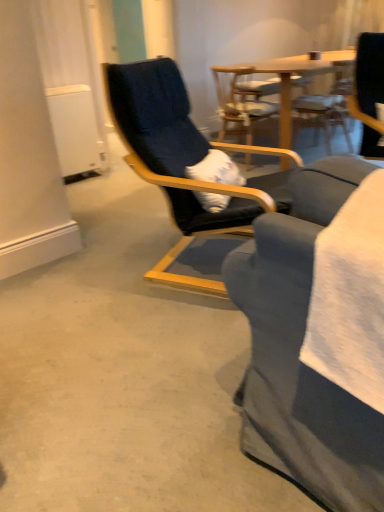
Question: Considering the relative sizes of wooden chair at center, positioned as the 2th chair in back-to-front order, and wooden chair at center, arranged as the third chair when viewed from the front, in the image provided, is wooden chair at center, positioned as the 2th chair in back-to-front order, shorter than wooden chair at center, arranged as the third chair when viewed from the front,?

Choices:
 (A) yes
 (B) no

Answer: (A)

Question: Is wooden chair at center, placed as the second chair when sorted from front to back, in contact with wooden chair at center, arranged as the third chair when viewed from the front?

Choices:
 (A) no
 (B) yes

Answer: (A)

Question: Considering the relative sizes of wooden chair at center, positioned as the 2th chair in back-to-front order, and wooden chair at center, the 1th chair in the back-to-front sequence, in the image provided, is wooden chair at center, positioned as the 2th chair in back-to-front order, bigger than wooden chair at center, the 1th chair in the back-to-front sequence,?

Choices:
 (A) yes
 (B) no

Answer: (B)

Question: Can you confirm if wooden chair at center, placed as the second chair when sorted from front to back, is positioned to the right of wooden chair at center, the 1th chair in the back-to-front sequence?

Choices:
 (A) no
 (B) yes

Answer: (A)

Question: Would you say wooden chair at center, placed as the second chair when sorted from front to back, contains wooden chair at center, the 1th chair in the back-to-front sequence?

Choices:
 (A) no
 (B) yes

Answer: (A)

Question: From a real-world perspective, is black fabric chair at center, acting as the 3th chair starting from the back, physically located above or below wooden chair at center, the 1th chair in the back-to-front sequence?

Choices:
 (A) above
 (B) below

Answer: (A)

Question: In terms of width, does black fabric chair at center, acting as the 3th chair starting from the back, look wider or thinner when compared to wooden chair at center, the 1th chair in the back-to-front sequence?

Choices:
 (A) thin
 (B) wide

Answer: (B)

Question: From the image's perspective, is black fabric chair at center, positioned as the first chair in front-to-back order, located above or below wooden chair at center, the 1th chair in the back-to-front sequence?

Choices:
 (A) above
 (B) below

Answer: (B)

Question: In terms of height, does black fabric chair at center, acting as the 3th chair starting from the back, look taller or shorter compared to wooden chair at center, arranged as the third chair when viewed from the front?

Choices:
 (A) tall
 (B) short

Answer: (A)

Question: Does point (223, 77) appear closer or farther from the camera than point (122, 78)?

Choices:
 (A) closer
 (B) farther

Answer: (B)

Question: Relative to black fabric chair at center, positioned as the first chair in front-to-back order, is wooden chair at center, placed as the second chair when sorted from front to back, in front or behind?

Choices:
 (A) front
 (B) behind

Answer: (B)

Question: From a real-world perspective, is wooden chair at center, positioned as the 2th chair in back-to-front order, positioned above or below black fabric chair at center, acting as the 3th chair starting from the back?

Choices:
 (A) above
 (B) below

Answer: (B)

Question: From the image's perspective, is wooden chair at center, placed as the second chair when sorted from front to back, located above or below black fabric chair at center, acting as the 3th chair starting from the back?

Choices:
 (A) below
 (B) above

Answer: (B)

Question: Considering the positions of wooden chair at center, arranged as the third chair when viewed from the front, and wooden chair at center, positioned as the 2th chair in back-to-front order, in the image, is wooden chair at center, arranged as the third chair when viewed from the front, taller or shorter than wooden chair at center, positioned as the 2th chair in back-to-front order,?

Choices:
 (A) tall
 (B) short

Answer: (A)

Question: From a real-world perspective, is wooden chair at center, arranged as the third chair when viewed from the front, positioned above or below wooden chair at center, positioned as the 2th chair in back-to-front order?

Choices:
 (A) below
 (B) above

Answer: (A)